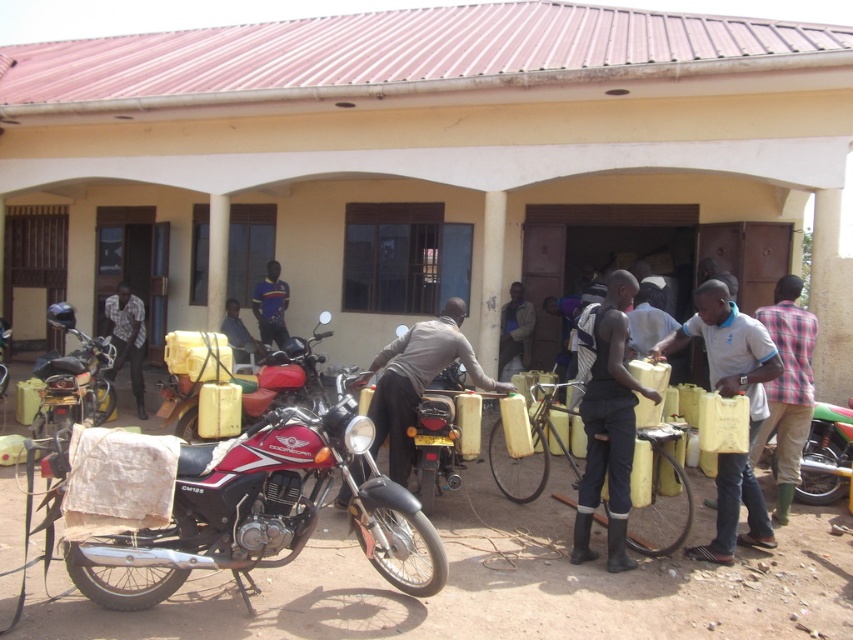
Question: Which point is farther to the camera?

Choices:
 (A) (125, 291)
 (B) (380, 410)
 (C) (780, 490)

Answer: (A)

Question: Which point is farther from the camera taking this photo?

Choices:
 (A) (137, 394)
 (B) (461, 314)
 (C) (172, 515)

Answer: (A)

Question: Can you confirm if red glossy motorcycle at left is thinner than brushed metal motorcycle at center?

Choices:
 (A) yes
 (B) no

Answer: (A)

Question: Which of the following is the farthest from the observer?

Choices:
 (A) brushed metal motorcycle at center
 (B) plaid fabric shirt at center-right
 (C) black rubber boots at lower center
 (D) light blue t-shirt at center

Answer: (A)

Question: Can you confirm if red glossy motorcycle at center is positioned to the left of light blue t-shirt at center?

Choices:
 (A) yes
 (B) no

Answer: (A)

Question: Is red glossy motorcycle at center smaller than brushed metal motorcycle at center?

Choices:
 (A) yes
 (B) no

Answer: (B)